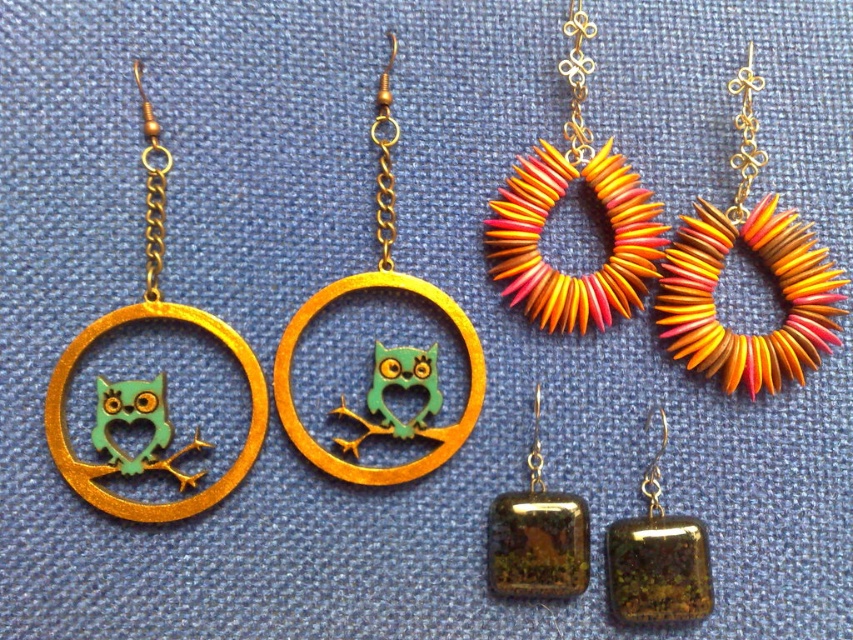
Question: Does gold textured square at lower right have a smaller size compared to green matte owl at center?

Choices:
 (A) no
 (B) yes

Answer: (A)

Question: Which is nearer to the gold textured square at lower right?

Choices:
 (A) gold textured square at bottom right
 (B) gold metallic owl at center

Answer: (A)

Question: Is gold metallic owl at left above gold textured square at bottom right?

Choices:
 (A) no
 (B) yes

Answer: (B)

Question: Which point appears closest to the camera in this image?

Choices:
 (A) (375, 381)
 (B) (248, 458)
 (C) (804, 280)
 (D) (380, 372)

Answer: (B)

Question: Is gold textured square at lower right in front of green matte owl at left?

Choices:
 (A) no
 (B) yes

Answer: (A)

Question: Among these objects, which one is nearest to the camera?

Choices:
 (A) green matte owl at center
 (B) orange and yellow beaded hoop at upper center
 (C) gold textured square at bottom right
 (D) green matte owl at left

Answer: (D)